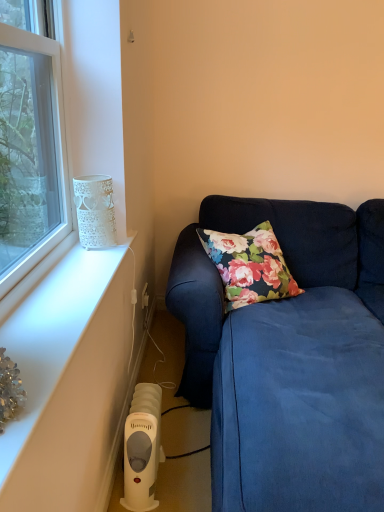
Describe the element at coordinates (290, 359) in the screenshot. I see `velvet blue couch at lower right` at that location.

This screenshot has width=384, height=512. I want to click on velvet blue couch at lower right, so 290,359.

Measure the distance between velvet blue couch at lower right and camera.

velvet blue couch at lower right and camera are 39.24 inches apart from each other.

The height and width of the screenshot is (512, 384). In order to click on velvet blue couch at lower right in this screenshot , I will do `click(290, 359)`.